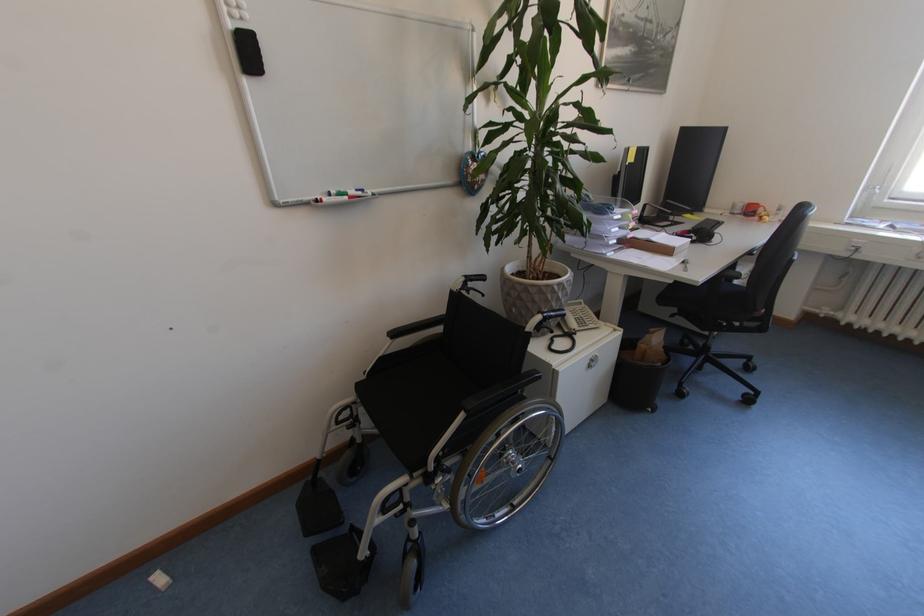
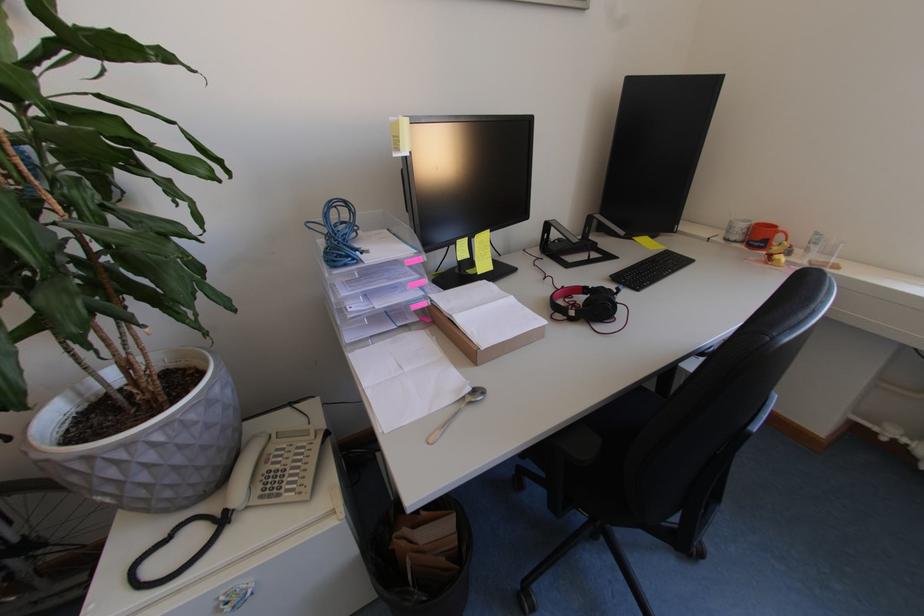
The point at [701,238] is marked in the first image. Where is the corresponding point in the second image?

(579, 314)